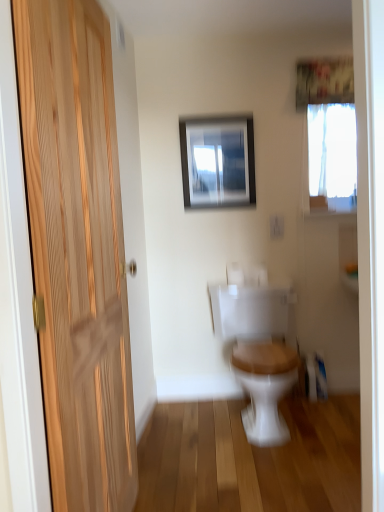
Question: Is white sheer curtain at upper center next to wooden door at left and touching it?

Choices:
 (A) yes
 (B) no

Answer: (B)

Question: From a real-world perspective, is white sheer curtain at upper center located higher than wooden door at left?

Choices:
 (A) no
 (B) yes

Answer: (B)

Question: Considering the relative sizes of white sheer curtain at upper center and wooden door at left in the image provided, is white sheer curtain at upper center bigger than wooden door at left?

Choices:
 (A) yes
 (B) no

Answer: (B)

Question: Is white sheer curtain at upper center at the left side of wooden door at left?

Choices:
 (A) yes
 (B) no

Answer: (B)

Question: Can you confirm if white sheer curtain at upper center is taller than wooden door at left?

Choices:
 (A) no
 (B) yes

Answer: (A)

Question: Is wooden door at left inside white sheer curtain at upper center?

Choices:
 (A) no
 (B) yes

Answer: (A)

Question: Is white wood toilet at center oriented towards metallic silver picture frame at upper center?

Choices:
 (A) no
 (B) yes

Answer: (A)

Question: Can you confirm if white wood toilet at center is thinner than metallic silver picture frame at upper center?

Choices:
 (A) no
 (B) yes

Answer: (A)

Question: Is white wood toilet at center bigger than metallic silver picture frame at upper center?

Choices:
 (A) no
 (B) yes

Answer: (B)

Question: From the image's perspective, is white wood toilet at center over metallic silver picture frame at upper center?

Choices:
 (A) yes
 (B) no

Answer: (B)

Question: Does white wood toilet at center have a greater width compared to metallic silver picture frame at upper center?

Choices:
 (A) yes
 (B) no

Answer: (A)

Question: Is white wood toilet at center located outside metallic silver picture frame at upper center?

Choices:
 (A) yes
 (B) no

Answer: (A)

Question: Can you confirm if wooden door at left is shorter than white sheer curtain at upper center?

Choices:
 (A) yes
 (B) no

Answer: (B)